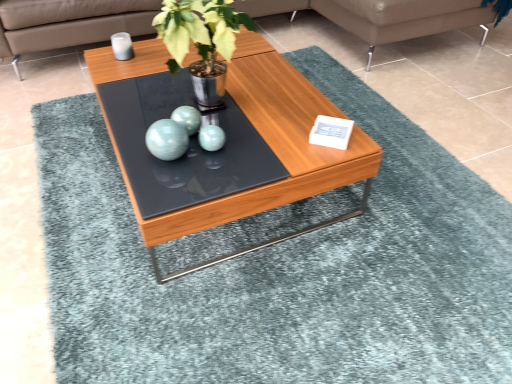
Identify the location of vacant space to the right of wooden coffee table at center. (416, 194).